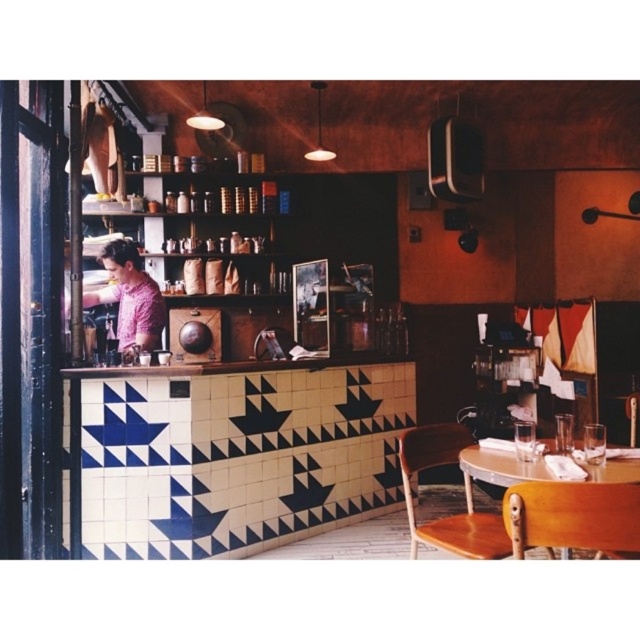
You are a customer in the cafe and want to sit at the wooden table at lower right. However, there is a pink textured shirt at left nearby. Can the shirt be moved to make space for you?

The pink textured shirt at left occupies less space than the wooden table at lower right, so moving it would require minimal effort. However, since the shirt takes up less area, it might not significantly hinder access to the table. Please check the exact placement for clearance.